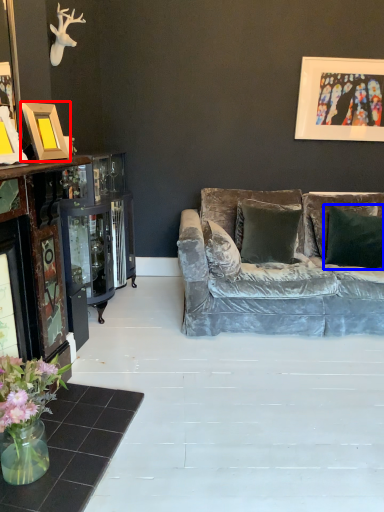
Question: Which object appears farthest to the camera in this image, picture frame (highlighted by a red box) or pillow (highlighted by a blue box)?

Choices:
 (A) picture frame
 (B) pillow

Answer: (B)